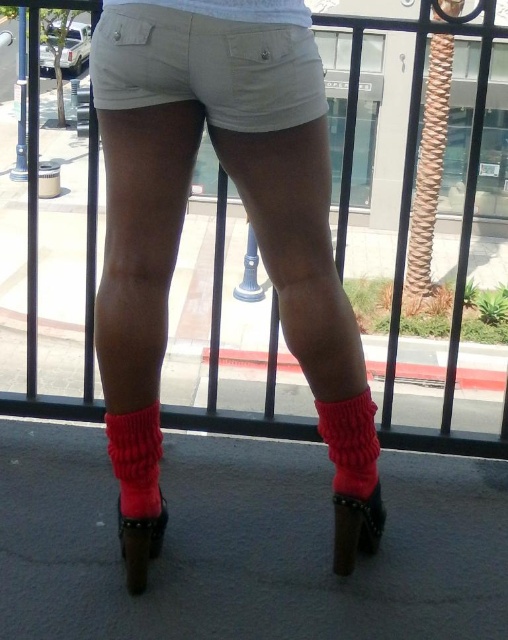
Is metallic black rail at center below crimson knitted sock at lower center?

Actually, metallic black rail at center is above crimson knitted sock at lower center.

Measure the distance between metallic black rail at center and camera.

37.69 inches

This screenshot has width=508, height=640. What are the coordinates of `metallic black rail at center` in the screenshot? It's located at (404, 244).

How far apart are light beige cotton shorts at center and crimson knitted sock at lower center?

A distance of 21.48 inches exists between light beige cotton shorts at center and crimson knitted sock at lower center.

Is light beige cotton shorts at center to the left of crimson knitted sock at lower center from the viewer's perspective?

Incorrect, light beige cotton shorts at center is not on the left side of crimson knitted sock at lower center.

Locate an element on the screen. This screenshot has width=508, height=640. light beige cotton shorts at center is located at coordinates (207, 67).

Can you confirm if metallic black rail at center is thinner than leather high-heeled shoe at lower center?

Incorrect, metallic black rail at center's width is not less than leather high-heeled shoe at lower center's.

In the scene shown: Is metallic black rail at center taller than leather high-heeled shoe at lower center?

Yes, metallic black rail at center is taller than leather high-heeled shoe at lower center.

Which is in front, point (62, 404) or point (141, 531)?

Point (141, 531)

Find the location of a particular element. The width and height of the screenshot is (508, 640). metallic black rail at center is located at coordinates (404, 244).